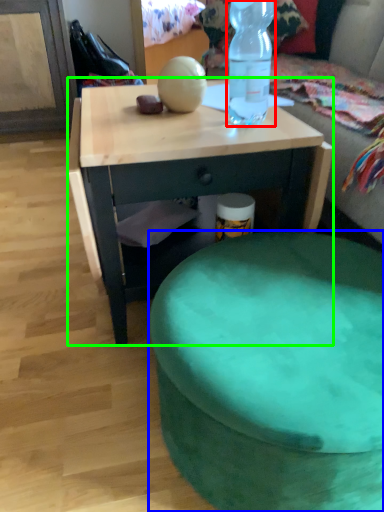
Question: Based on their relative distances, which object is farther from bottle (highlighted by a red box)? Choose from stool (highlighted by a blue box) and desk (highlighted by a green box).

Choices:
 (A) stool
 (B) desk

Answer: (A)